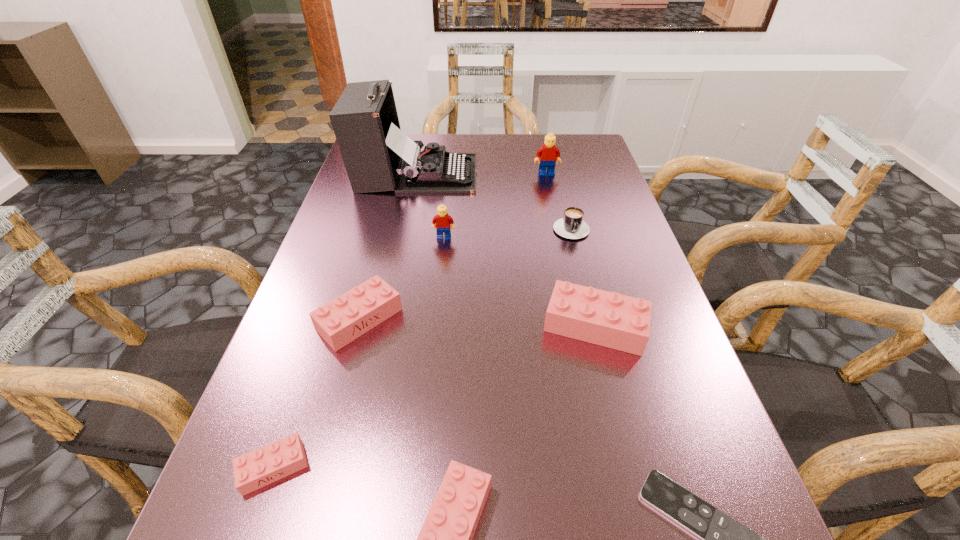
Find the location of a particular element. Image resolution: width=960 pixels, height=540 pixels. typewriter present at the left edge is located at coordinates (378, 156).

Where is `cappuccino positioned at the right edge`? Image resolution: width=960 pixels, height=540 pixels. cappuccino positioned at the right edge is located at coordinates (572, 226).

At what (x,y) coordinates should I click in order to perform the action: click on object present at the far left corner. Please return your answer as a coordinate pair (x, y). The width and height of the screenshot is (960, 540). Looking at the image, I should click on (378, 156).

Locate an element on the screen. object positioned at the far right corner is located at coordinates (549, 154).

Image resolution: width=960 pixels, height=540 pixels. Find the location of `vacant space at the left edge`. vacant space at the left edge is located at coordinates pos(252,415).

Locate an element on the screen. This screenshot has width=960, height=540. blank area at the right edge is located at coordinates (637, 505).

Where is `vacant space at the far right corner of the desktop`? The width and height of the screenshot is (960, 540). vacant space at the far right corner of the desktop is located at coordinates (593, 147).

Where is `unoccupied area between the left yellow Lego and the fourth tallest object`? Image resolution: width=960 pixels, height=540 pixels. unoccupied area between the left yellow Lego and the fourth tallest object is located at coordinates (519, 282).

Identify the location of vacant area that lies between the smaller yellow Lego and the second shortest object. (359, 353).

I want to click on empty location between the second biggest pink Lego and the smallest pink Lego, so click(317, 393).